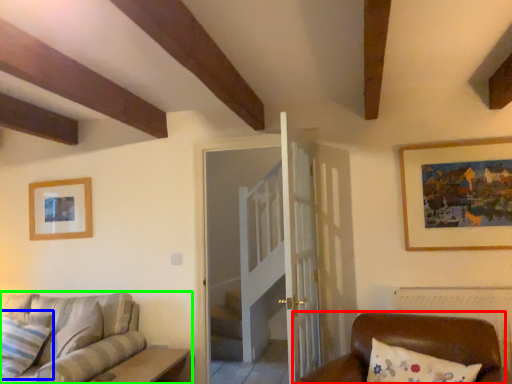
Question: Considering the real-world distances, which object is farthest from furniture (highlighted by a red box)? pillow (highlighted by a blue box) or studio couch (highlighted by a green box)?

Choices:
 (A) pillow
 (B) studio couch

Answer: (A)